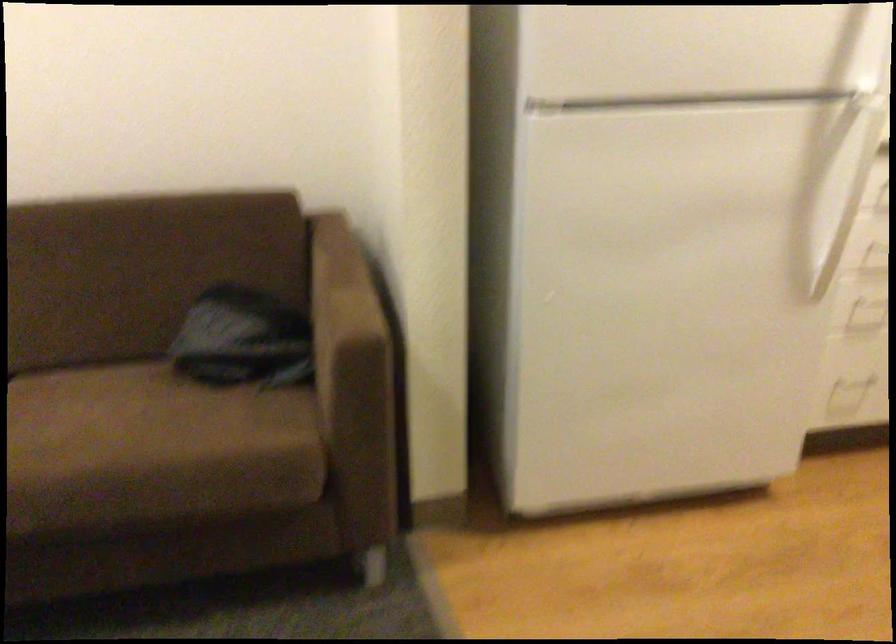
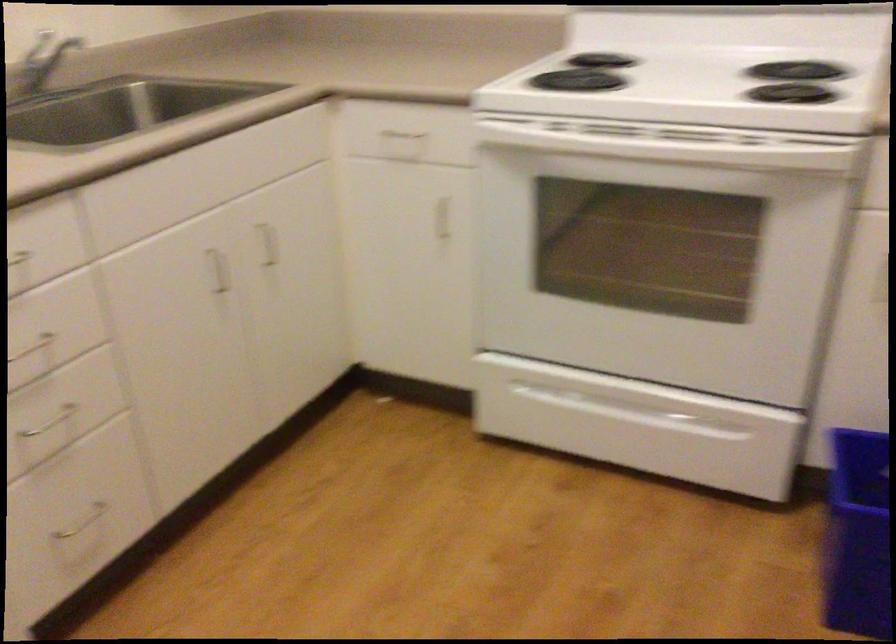
Question: The first image is from the beginning of the video and the second image is from the end. How did the camera likely rotate when shooting the video?

Choices:
 (A) Left
 (B) Right
 (C) Up
 (D) Down

Answer: (B)